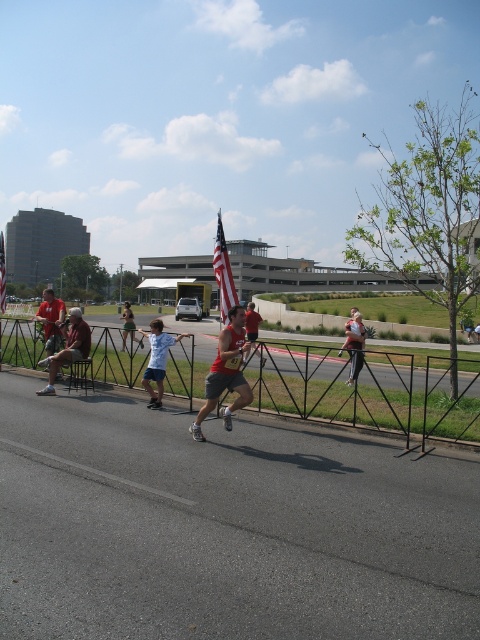
You are a photographer positioned at the starting line of the marathon. You want to capture a photo where both the red matte shirt at center and the american flag at center are visible in the frame. Based on their heights, which object will appear closer to the bottom of the photo?

The red matte shirt at center is shorter than the american flag at center, so the red matte shirt at center will appear closer to the bottom of the photo.

You are a photographer positioned at the camera location. You want to capture a photo of the point marked at coordinates point [238,376]. Considering the distance, is this point within your camera range if your camera can focus up to 30 feet?

The point [238,376] is 26.04 feet away from the camera, which is within the camera range of 30 feet. Therefore, the camera can focus on this point.